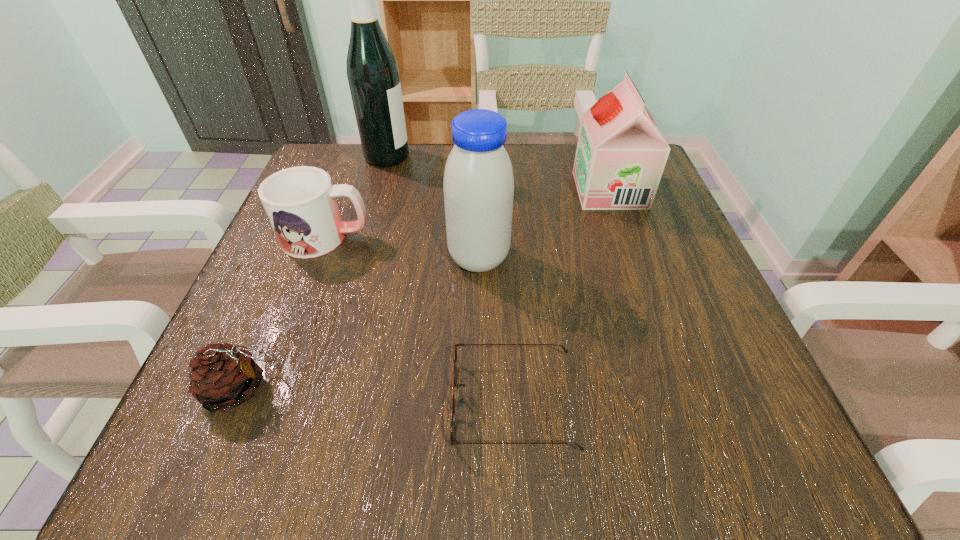
The height and width of the screenshot is (540, 960). In order to click on the farthest object in this screenshot , I will do `click(372, 70)`.

Locate an element on the screen. the tallest object is located at coordinates (372, 70).

The image size is (960, 540). In order to click on the second tallest object in this screenshot , I will do `click(478, 184)`.

What are the coordinates of `the left soya milk` in the screenshot? It's located at (478, 184).

Find the location of `the rightmost object`. the rightmost object is located at coordinates (621, 154).

Image resolution: width=960 pixels, height=540 pixels. I want to click on the right soya milk, so coord(621,154).

The width and height of the screenshot is (960, 540). In order to click on mug in this screenshot , I will do pyautogui.click(x=300, y=202).

Where is `the second shortest object`? Image resolution: width=960 pixels, height=540 pixels. the second shortest object is located at coordinates (222, 377).

Locate an element on the screen. sunglasses is located at coordinates (461, 402).

The height and width of the screenshot is (540, 960). What are the coordinates of `vacant point located 0.280m on the label of the farthest object` in the screenshot? It's located at (527, 157).